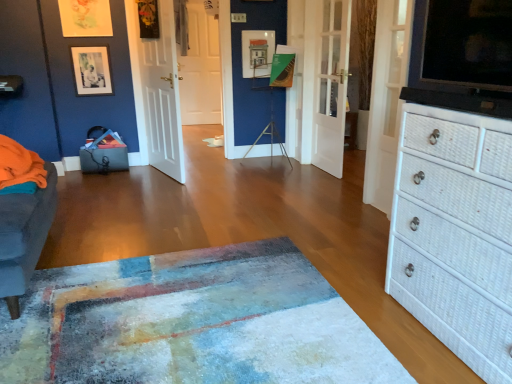
Question: Is white glossy door at center, the 2th door in the back-to-front sequence, oriented towards white wooden door at left, arranged as the 2th door when viewed from the front?

Choices:
 (A) no
 (B) yes

Answer: (B)

Question: Considering the relative positions of white glossy door at center, the 2th door in the back-to-front sequence, and white wooden door at left, which ranks as the first door in left-to-right order, in the image provided, is white glossy door at center, the 2th door in the back-to-front sequence, to the left of white wooden door at left, which ranks as the first door in left-to-right order, from the viewer's perspective?

Choices:
 (A) no
 (B) yes

Answer: (A)

Question: Is white glossy door at center, the 2th door in the back-to-front sequence, at the right side of white wooden door at left, arranged as the 2th door when viewed from the front?

Choices:
 (A) yes
 (B) no

Answer: (A)

Question: Does white glossy door at center, which is the 3th door from left to right, have a lesser width compared to white wooden door at left, placed as the fourth door when sorted from right to left?

Choices:
 (A) no
 (B) yes

Answer: (B)

Question: Considering the relative sizes of white glossy door at center, the 2th door positioned from the right, and white wooden door at left, arranged as the 2th door when viewed from the front, in the image provided, is white glossy door at center, the 2th door positioned from the right, bigger than white wooden door at left, arranged as the 2th door when viewed from the front,?

Choices:
 (A) yes
 (B) no

Answer: (B)

Question: From the image's perspective, is white glossy door at center, the 2th door positioned from the right, above or below white wooden door at left, which appears as the third door when viewed from the back?

Choices:
 (A) below
 (B) above

Answer: (B)

Question: Considering the relative positions of white glossy door at center, which is the 3th door from left to right, and white wooden door at left, arranged as the 2th door when viewed from the front, in the image provided, is white glossy door at center, which is the 3th door from left to right, to the left or to the right of white wooden door at left, arranged as the 2th door when viewed from the front,?

Choices:
 (A) left
 (B) right

Answer: (B)

Question: Relative to white wooden door at left, which ranks as the first door in left-to-right order, is white glossy door at center, the 2th door in the back-to-front sequence, in front or behind?

Choices:
 (A) behind
 (B) front

Answer: (A)

Question: Is white glossy door at center, which is the 3th door from left to right, bigger or smaller than white wooden door at left, which ranks as the first door in left-to-right order?

Choices:
 (A) big
 (B) small

Answer: (B)

Question: From a real-world perspective, is white glossy door at center, the 2th door positioned from the right, positioned above or below textured blue rug at center?

Choices:
 (A) below
 (B) above

Answer: (B)

Question: In terms of width, does white glossy door at center, which is the 3th door from left to right, look wider or thinner when compared to textured blue rug at center?

Choices:
 (A) thin
 (B) wide

Answer: (A)

Question: Visually, is white glossy door at center, which is the 3th door from left to right, positioned to the left or to the right of textured blue rug at center?

Choices:
 (A) left
 (B) right

Answer: (B)

Question: Looking at the image, does white glossy door at center, which is the 3th door from left to right, seem bigger or smaller compared to textured blue rug at center?

Choices:
 (A) small
 (B) big

Answer: (A)

Question: Looking at their shapes, would you say white wooden door at left, arranged as the 2th door when viewed from the front, is wider or thinner than white glossy door at center, the 2th door positioned from the right?

Choices:
 (A) wide
 (B) thin

Answer: (A)

Question: Looking at the image, does white wooden door at left, arranged as the 2th door when viewed from the front, seem bigger or smaller compared to white glossy door at center, which is the 3th door from left to right?

Choices:
 (A) big
 (B) small

Answer: (A)